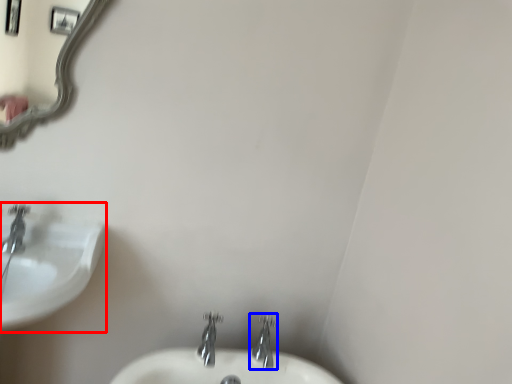
Question: Which of the following is the closest to the observer, sink (highlighted by a red box) or tap (highlighted by a blue box)?

Choices:
 (A) sink
 (B) tap

Answer: (A)